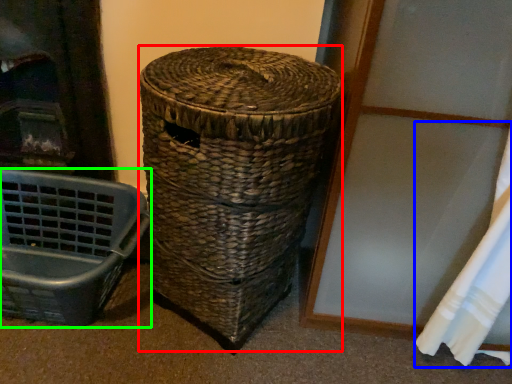
Question: Which is farther away from basket (highlighted by a red box)? curtain (highlighted by a blue box) or furniture (highlighted by a green box)?

Choices:
 (A) curtain
 (B) furniture

Answer: (A)